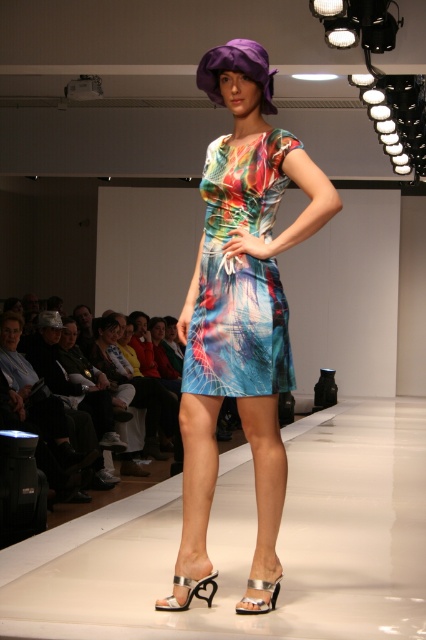
Looking at this image, you are a photographer positioned at point A. You want to take a photo of the runway scene. There are two points marked in the image, point A at coordinates point A is at point (383, 614) and point B at coordinates point B is at point (199, 77). If you move to point A, will you be closer to the runway than when you were at point B?

Point A at coordinates point A is at point (383, 614) is in front of point B at coordinates point B is at point (199, 77), so moving to point A would place you closer to the runway than when you were at point B.